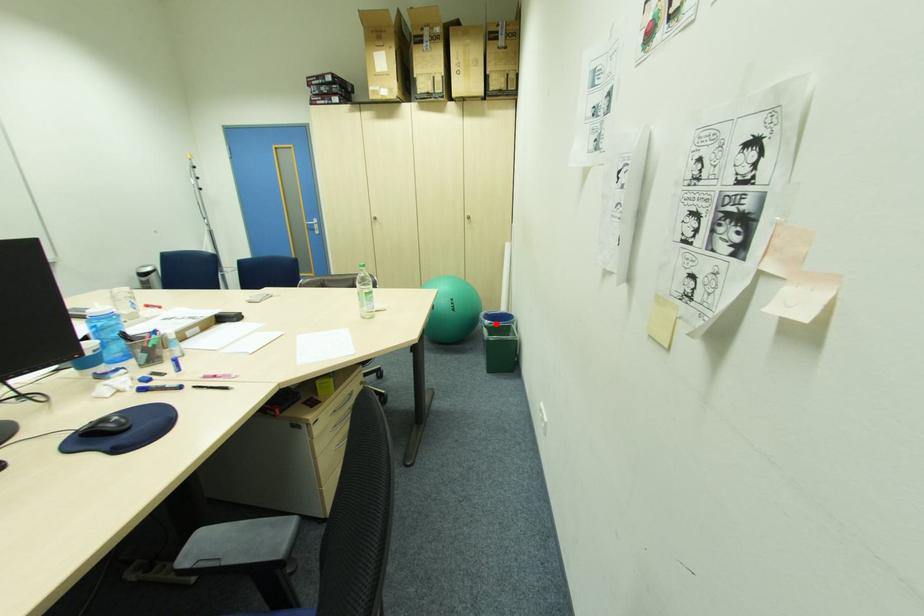
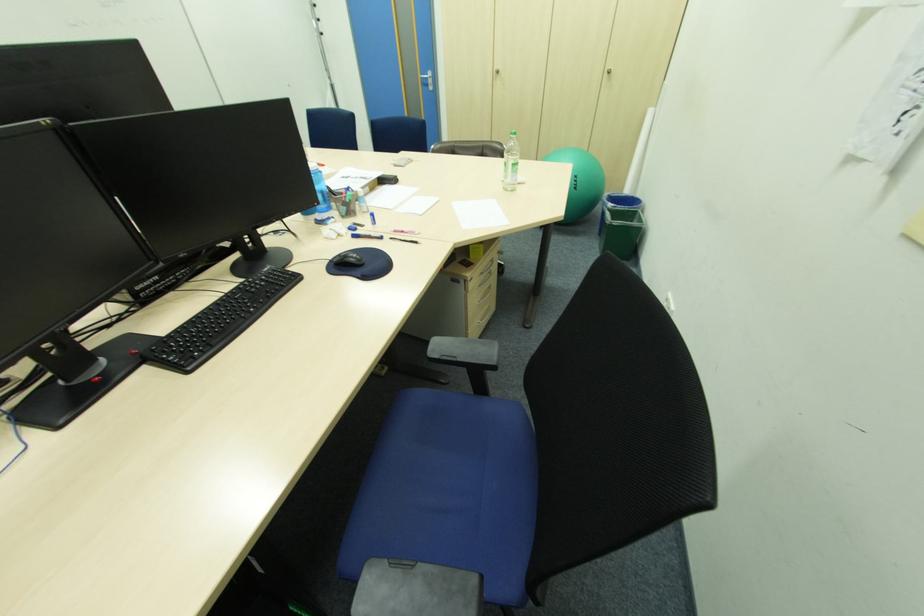
In the second image, find the point that corresponds to the highlighted location in the first image.

(621, 207)